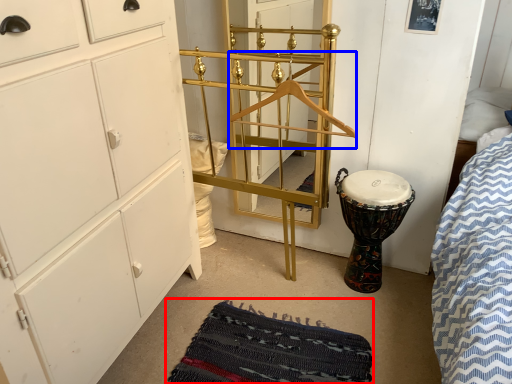
Question: Which object is further to the camera taking this photo, mat (highlighted by a red box) or hanger (highlighted by a blue box)?

Choices:
 (A) mat
 (B) hanger

Answer: (B)